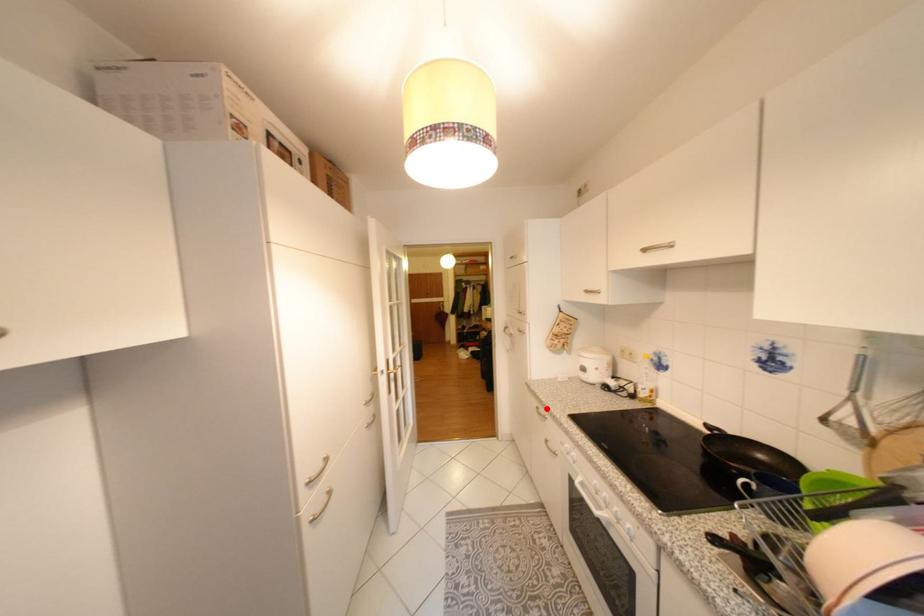
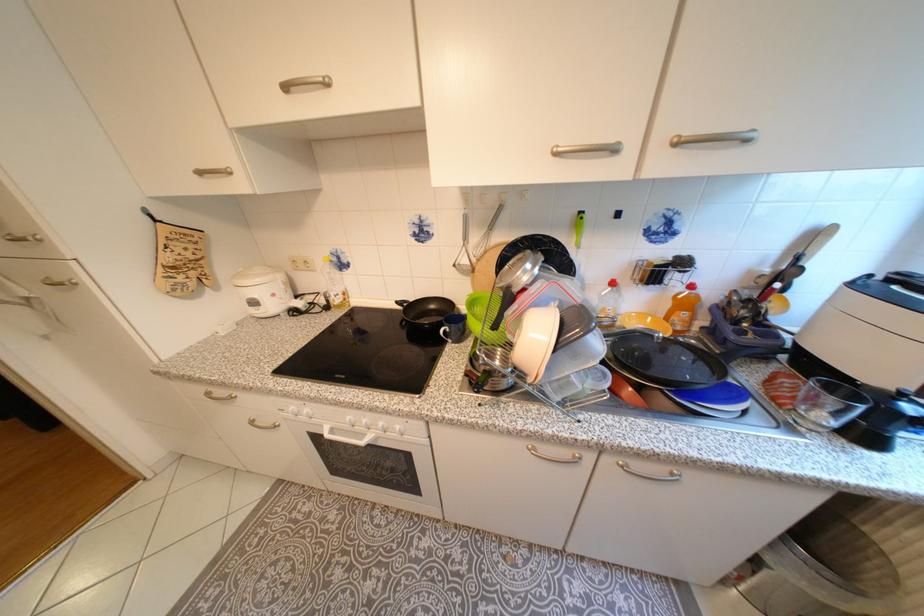
Where in the second image is the point corresponding to the highlighted location from the first image?

(217, 394)